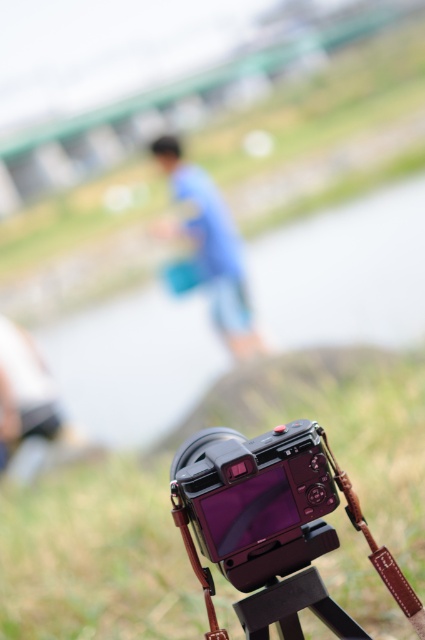
Can you confirm if green grass at lower center is thinner than satin black camera at center?

No.

Image resolution: width=425 pixels, height=640 pixels. Describe the element at coordinates (96, 556) in the screenshot. I see `green grass at lower center` at that location.

Who is more forward, (377, 355) or (243, 516)?

Positioned in front is point (243, 516).

You are a GUI agent. You are given a task and a screenshot of the screen. Output one action in this format:
    pyautogui.click(x=<x>, y=<y>)
    Task: Click on the green grass at lower center
    This screenshot has width=425, height=640.
    Given the screenshot: What is the action you would take?
    [96, 556]

Who is more distant from viewer, (309, 509) or (209, 196)?

Point (209, 196)

Where is `satin black camera at center`? This screenshot has width=425, height=640. satin black camera at center is located at coordinates (257, 499).

Which is in front, point (221, 294) or point (272, 608)?

Point (272, 608) is more forward.

Find the location of `blue fabric person at center`. blue fabric person at center is located at coordinates (210, 244).